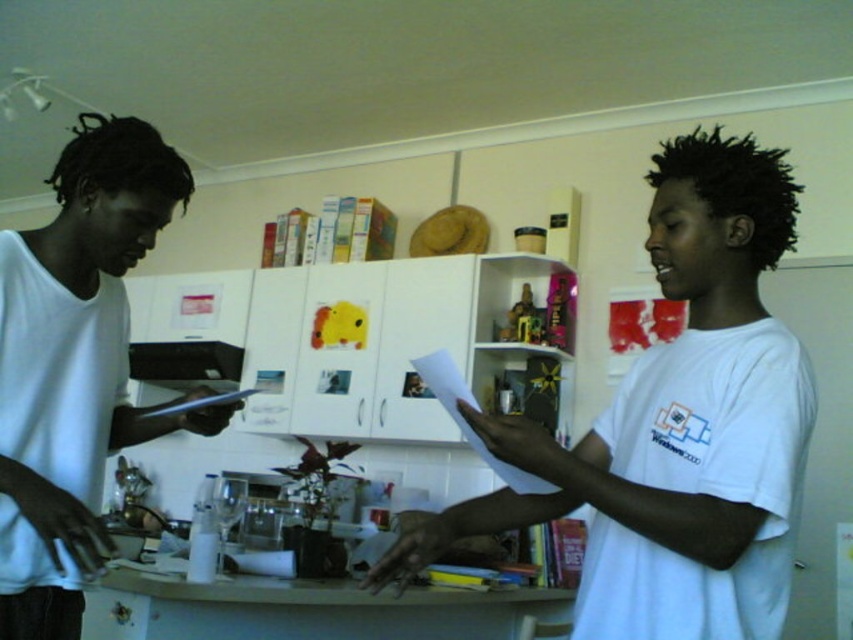
Question: Considering the real-world distances, which object is farthest from the black plastic exhaust hood at upper center?

Choices:
 (A) black hair at center
 (B) white matte shirt at left

Answer: (A)

Question: Which of the following is the closest to the observer?

Choices:
 (A) black plastic exhaust hood at upper center
 (B) black hair at center

Answer: (B)

Question: Can you confirm if black hair at center is positioned below black plastic exhaust hood at upper center?

Choices:
 (A) yes
 (B) no

Answer: (B)

Question: Estimate the real-world distances between objects in this image. Which object is closer to the black hair at center?

Choices:
 (A) white matte shirt at left
 (B) black plastic exhaust hood at upper center

Answer: (A)

Question: Can you confirm if white matte shirt at left is bigger than black hair at center?

Choices:
 (A) no
 (B) yes

Answer: (B)

Question: Does white matte shirt at left lie in front of black hair at center?

Choices:
 (A) yes
 (B) no

Answer: (B)